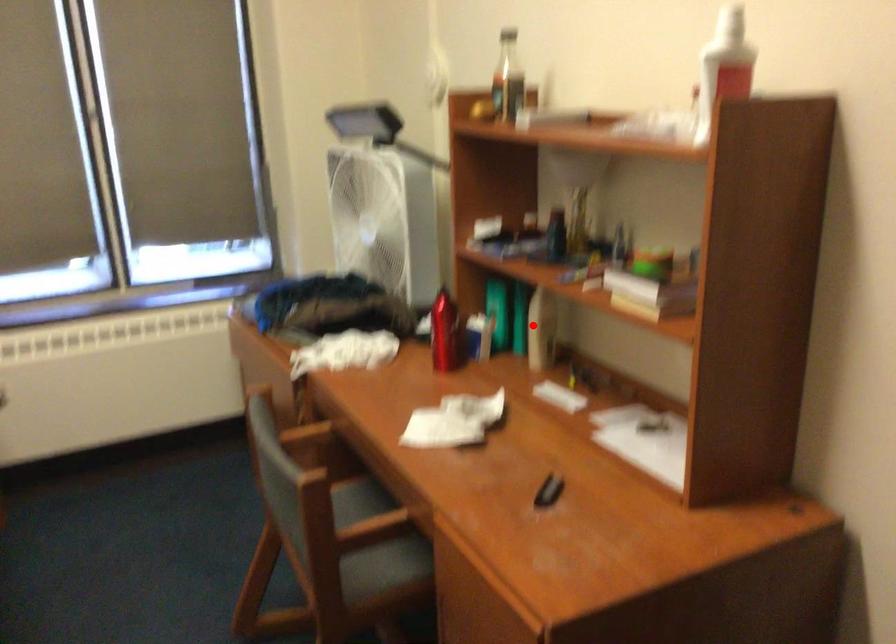
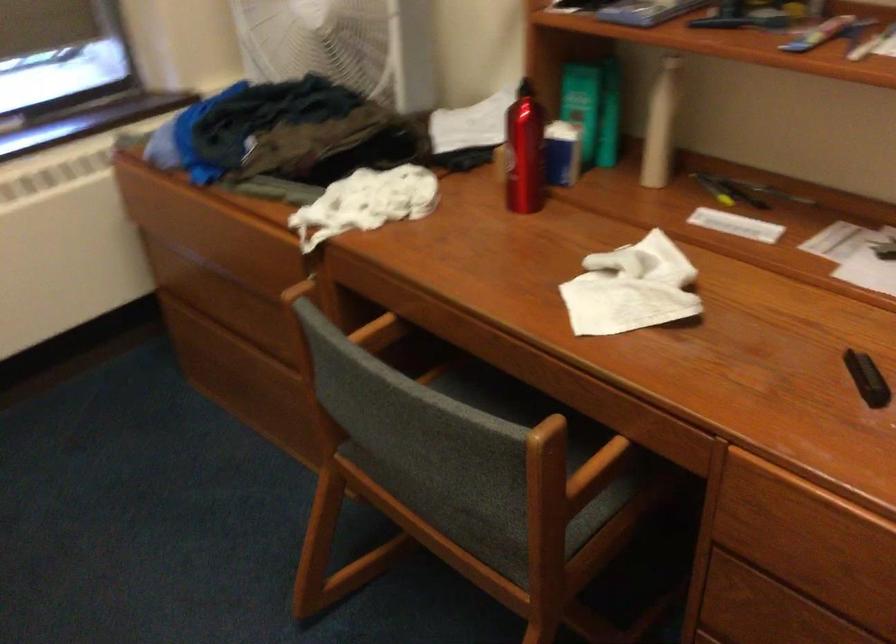
The point at the highlighted location is marked in the first image. Where is the corresponding point in the second image?

(659, 125)